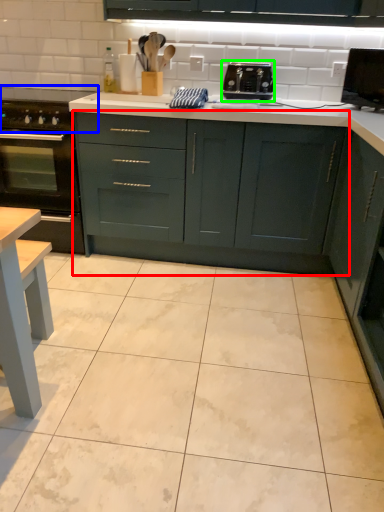
Question: Which object is positioned closest to cabinetry (highlighted by a red box)? Select from gas stove (highlighted by a blue box) and toaster (highlighted by a green box).

Choices:
 (A) gas stove
 (B) toaster

Answer: (B)